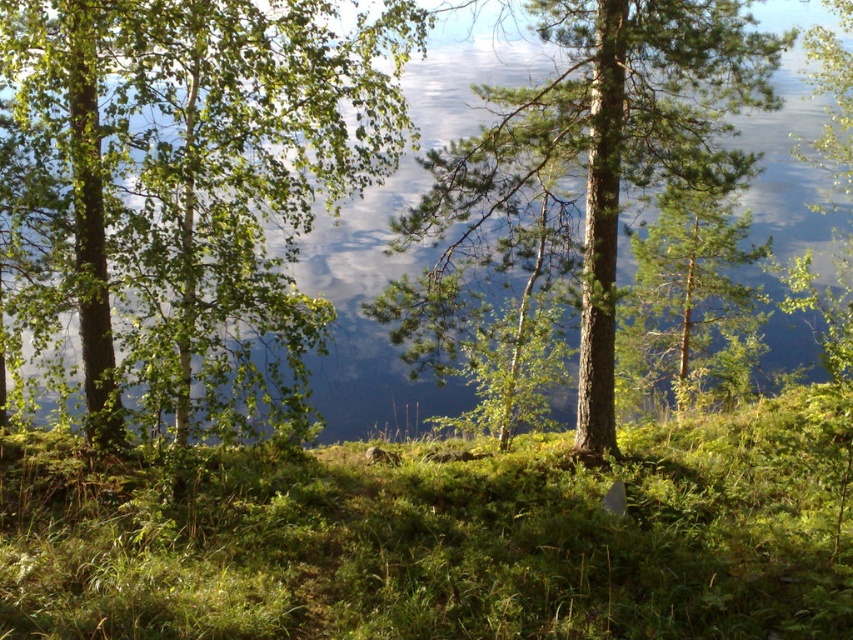
You are a gardener planning to mow the lawn. You see the green leafy grass at center and the green rough bark tree at center. Which one has a wider base?

The green leafy grass at center has a wider base than the green rough bark tree at center, as its width surpasses the tree.

You are planning to plant a new tree in your backyard. You have two options based on the image provided. The first option is the green leafy tree at left, and the second is the green rough bark tree at center. If you want a smaller tree for limited space, which one should you choose?

The green leafy tree at left has a smaller size compared to the green rough bark tree at center, so you should choose the green leafy tree at left for limited space.

You are a gardener planning to plant a new flower bed between the green leafy grass at center and the green rough bark tree at center. Which side of the tree should you place the flowers so they are closer to the grass?

The green leafy grass at center is positioned on the left side of the green rough bark tree at center, so planting the flowers on the left side of the tree will place them closer to the grass.